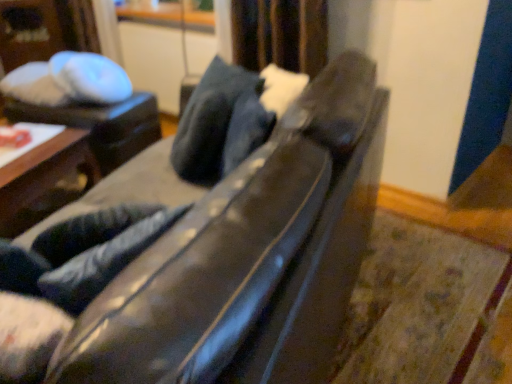
Question: Is white glossy table at upper left, which ranks as the 2th table in front-to-back order, placed right next to black leather couch at center?

Choices:
 (A) yes
 (B) no

Answer: (B)

Question: From a real-world perspective, is white glossy table at upper left, which ranks as the 2th table in front-to-back order, positioned under black leather couch at center based on gravity?

Choices:
 (A) no
 (B) yes

Answer: (B)

Question: Can you confirm if white glossy table at upper left, which ranks as the 2th table in front-to-back order, is positioned to the left of black leather couch at center?

Choices:
 (A) yes
 (B) no

Answer: (A)

Question: Could you tell me if white glossy table at upper left, the 1th table in the back-to-front sequence, is facing black leather couch at center?

Choices:
 (A) yes
 (B) no

Answer: (B)

Question: From a real-world perspective, is white glossy table at upper left, the 1th table in the back-to-front sequence, positioned over black leather couch at center based on gravity?

Choices:
 (A) no
 (B) yes

Answer: (A)

Question: From a real-world perspective, is wooden table at left, which is counted as the first table, starting from the front, positioned under dark blue leather pillow at center based on gravity?

Choices:
 (A) no
 (B) yes

Answer: (B)

Question: Is the position of wooden table at left, which is counted as the second table, starting from the back, less distant than that of dark blue leather pillow at center?

Choices:
 (A) no
 (B) yes

Answer: (A)

Question: Is wooden table at left, which is counted as the first table, starting from the front, turned away from dark blue leather pillow at center?

Choices:
 (A) no
 (B) yes

Answer: (A)

Question: Can you confirm if wooden table at left, which is counted as the second table, starting from the back, is positioned to the right of dark blue leather pillow at center?

Choices:
 (A) no
 (B) yes

Answer: (A)

Question: Is the surface of wooden table at left, which is counted as the second table, starting from the back, in direct contact with dark blue leather pillow at center?

Choices:
 (A) no
 (B) yes

Answer: (A)

Question: From the image's perspective, is wooden table at left, which is counted as the second table, starting from the back, over dark blue leather pillow at center?

Choices:
 (A) no
 (B) yes

Answer: (A)

Question: From the image's perspective, is satin dark blue curtain at upper center over wooden table at left, which is counted as the first table, starting from the front?

Choices:
 (A) yes
 (B) no

Answer: (A)